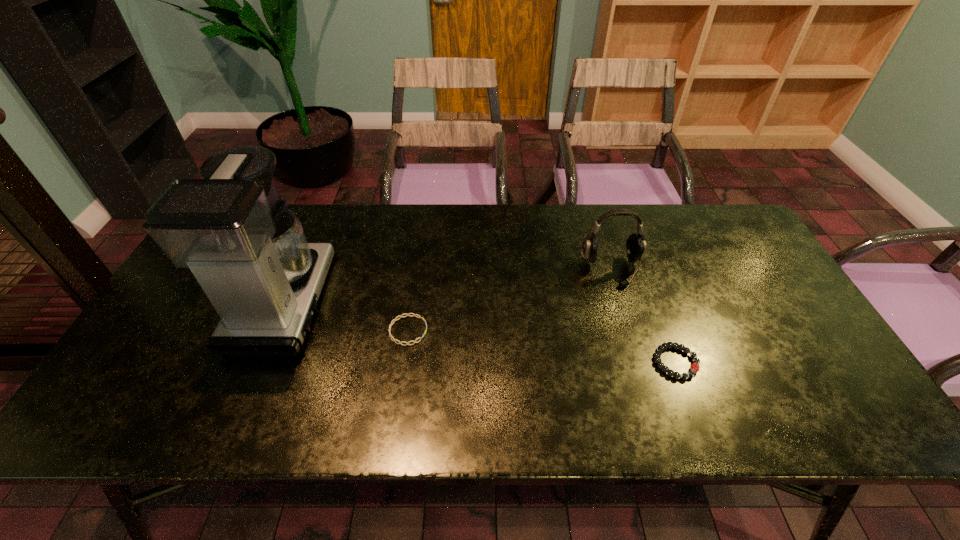
The width and height of the screenshot is (960, 540). What are the coordinates of `free space between the shortest object and the coffee maker` in the screenshot? It's located at (347, 316).

Identify the location of vacant area that lies between the right bracelet and the shorter bracelet. The width and height of the screenshot is (960, 540). (542, 346).

At what (x,y) coordinates should I click in order to perform the action: click on free point between the headset and the right bracelet. Please return your answer as a coordinate pair (x, y). Looking at the image, I should click on (644, 316).

Locate an element on the screen. The image size is (960, 540). vacant region between the second tallest object and the left bracelet is located at coordinates (510, 300).

You are a GUI agent. You are given a task and a screenshot of the screen. Output one action in this format:
    pyautogui.click(x=<x>, y=<y>)
    Task: Click on the free spot between the left bracelet and the coffee maker
    
    Given the screenshot: What is the action you would take?
    pyautogui.click(x=347, y=316)

Identify the location of object identified as the second closest to the left bracelet. (636, 244).

Select which object is the third closest to the right bracelet. Please provide its 2D coordinates. Your answer should be formatted as a tuple, i.e. [(x, y)], where the tuple contains the x and y coordinates of a point satisfying the conditions above.

[(249, 253)]

Where is `vacant point that satisfies the following two spatial constraints: 1. at the front of the coffee maker where the controls are located; 2. on the right side of the right bracelet`? The image size is (960, 540). vacant point that satisfies the following two spatial constraints: 1. at the front of the coffee maker where the controls are located; 2. on the right side of the right bracelet is located at coordinates (259, 362).

At what (x,y) coordinates should I click in order to perform the action: click on vacant area in the image that satisfies the following two spatial constraints: 1. with the microphone on the side of the second tallest object; 2. at the front of the tallest object where the controls are located. Please return your answer as a coordinate pair (x, y). Looking at the image, I should click on (621, 301).

Image resolution: width=960 pixels, height=540 pixels. Identify the location of vacant space that satisfies the following two spatial constraints: 1. with the microphone on the side of the right bracelet; 2. on the left side of the headset. (639, 362).